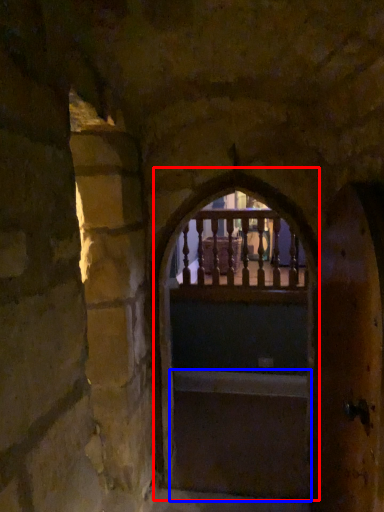
Question: Which object appears closest to the camera in this image, archway (highlighted by a red box) or stairs (highlighted by a blue box)?

Choices:
 (A) archway
 (B) stairs

Answer: (A)